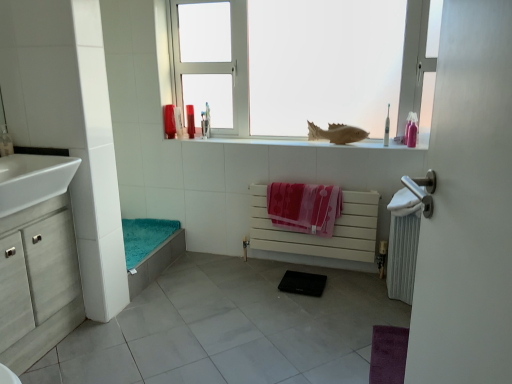
At what (x,y) coordinates should I click in order to perform the action: click on blank space above white matte radiator at center, marked as the 2th radiator in a right-to-left arrangement (from a real-world perspective). Please return your answer as a coordinate pair (x, y). Looking at the image, I should click on (308, 181).